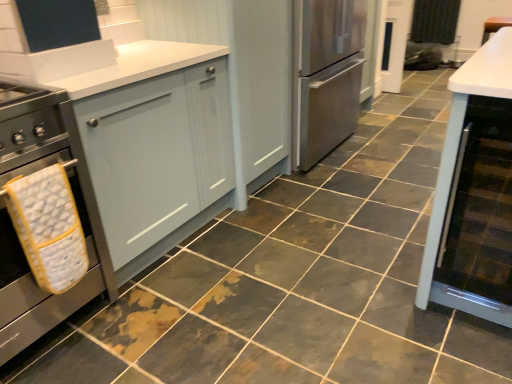
You are a GUI agent. You are given a task and a screenshot of the screen. Output one action in this format:
    pyautogui.click(x=<x>, y=<y>)
    Task: Click on the blank space to the left of matte glass cabinet at right, positioned as the 1th cabinetry in right-to-left order
    The height and width of the screenshot is (384, 512).
    Given the screenshot: What is the action you would take?
    pyautogui.click(x=406, y=318)